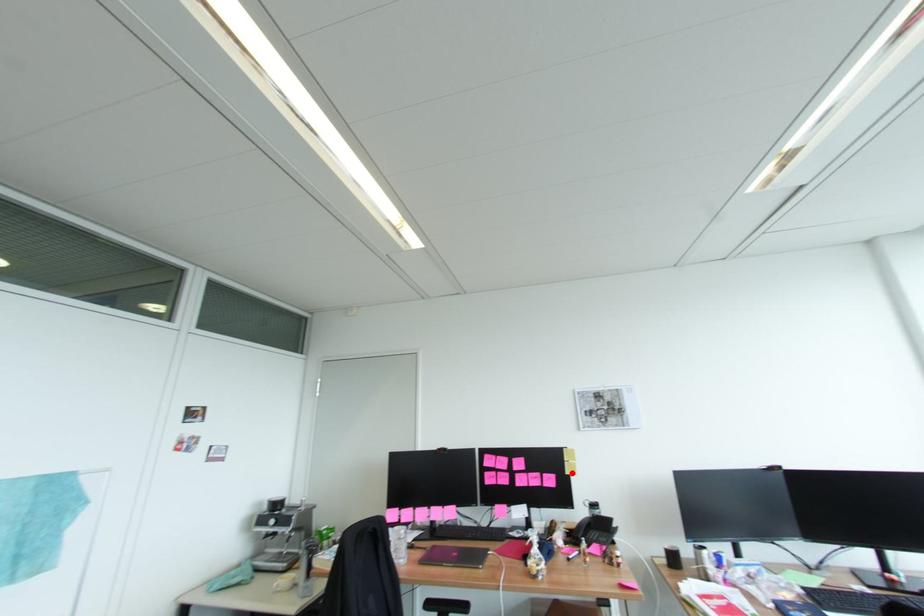
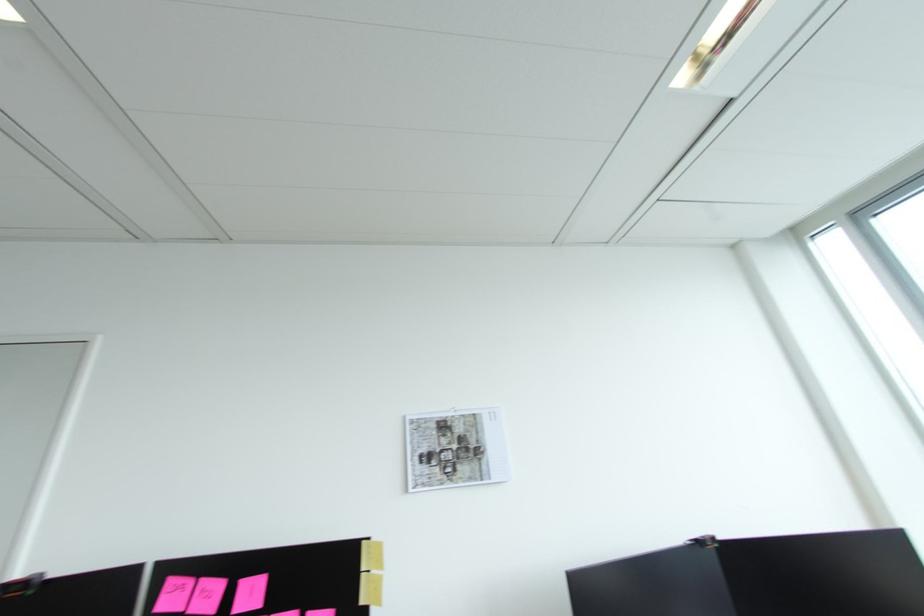
Question: I am providing you with two images of the same scene from different viewpoints. In image1, a red point is highlighted. Considering the same 3D point in image2, which of the following is correct?

Choices:
 (A) It is closer
 (B) It is farther

Answer: (A)